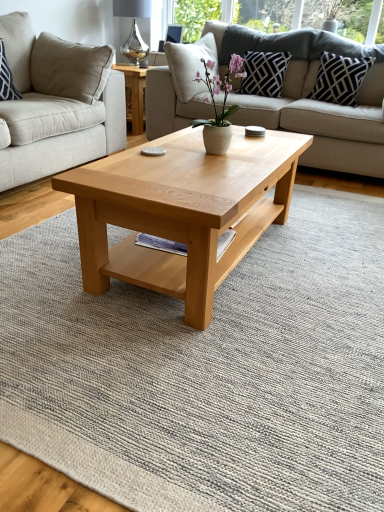
Locate an element on the screen. empty space that is ontop of dark blue geometric-patterned pillow at upper right, placed as the 3th pillow when sorted from left to right (from a real-world perspective) is located at coordinates (342, 53).